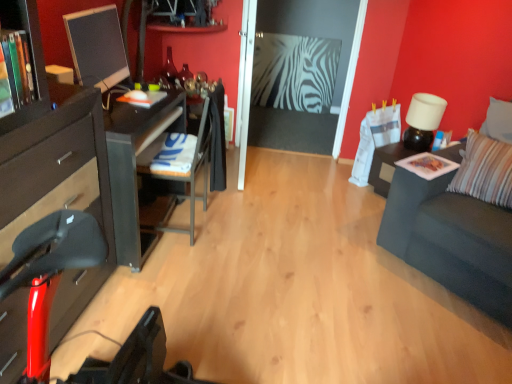
Image resolution: width=512 pixels, height=384 pixels. What do you see at coordinates (180, 163) in the screenshot?
I see `metallic gray chair at center-left` at bounding box center [180, 163].

What do you see at coordinates (451, 240) in the screenshot? I see `dark gray fabric couch at right` at bounding box center [451, 240].

The width and height of the screenshot is (512, 384). What do you see at coordinates (30, 61) in the screenshot?
I see `wooden bookshelf at left` at bounding box center [30, 61].

Image resolution: width=512 pixels, height=384 pixels. Identify the location of wooden bookshelf at left. (30, 61).

The image size is (512, 384). Identify the location of white matte lamp at upper right. (423, 121).

Locate an element on the screen. metallic silver shelf at upper center is located at coordinates (183, 16).

At what (x,y) coordinates should I click in order to perform the action: click on striped fabric pillow at right. Please return your answer as a coordinate pair (x, y). Looking at the image, I should click on (485, 170).

Considering the relative sizes of white matte lamp at upper right and striped fabric pillow at right in the image provided, is white matte lamp at upper right wider than striped fabric pillow at right?

Incorrect, the width of white matte lamp at upper right does not surpass that of striped fabric pillow at right.

Which object is positioned more to the right, white matte lamp at upper right or striped fabric pillow at right?

From the viewer's perspective, striped fabric pillow at right appears more on the right side.

Is white matte lamp at upper right beside striped fabric pillow at right?

white matte lamp at upper right and striped fabric pillow at right are not in contact.

Is striped fabric pillow at right with dark gray fabric couch at right?

No, striped fabric pillow at right is not next to dark gray fabric couch at right.

In the scene shown: Do you think striped fabric pillow at right is within dark gray fabric couch at right, or outside of it?

striped fabric pillow at right can be found inside dark gray fabric couch at right.

How different are the orientations of striped fabric pillow at right and dark gray fabric couch at right in degrees?

striped fabric pillow at right and dark gray fabric couch at right are facing 14.5 degrees away from each other.

Consider the image. Is matte black monitor at left in contact with metallic silver shelf at upper center?

No, matte black monitor at left is not in contact with metallic silver shelf at upper center.

In the image, is matte black monitor at left positioned in front of or behind metallic silver shelf at upper center?

Visually, matte black monitor at left is located in front of metallic silver shelf at upper center.

From a real-world perspective, is matte black monitor at left positioned over metallic silver shelf at upper center based on gravity?

No, from a real-world perspective, matte black monitor at left is not over metallic silver shelf at upper center

From the image's perspective, is matte black monitor at left over metallic silver shelf at upper center?

No, from the image's perspective, matte black monitor at left is not above metallic silver shelf at upper center.

Considering their positions, is striped fabric pillow at right located in front of or behind metallic gray chair at center-left?

Visually, striped fabric pillow at right is located in front of metallic gray chair at center-left.

Between striped fabric pillow at right and metallic gray chair at center-left, which one appears on the left side from the viewer's perspective?

From the viewer's perspective, metallic gray chair at center-left appears more on the left side.

Consider the image. Is striped fabric pillow at right next to metallic gray chair at center-left and touching it?

No, striped fabric pillow at right is not in contact with metallic gray chair at center-left.

Can you confirm if striped fabric pillow at right is bigger than metallic gray chair at center-left?

No.

Are white matte lamp at upper right and dark gray fabric couch at right located far from each other?

No, white matte lamp at upper right is in close proximity to dark gray fabric couch at right.

Consider the image. What's the angular difference between white matte lamp at upper right and dark gray fabric couch at right's facing directions?

2.84 degrees separate the facing orientations of white matte lamp at upper right and dark gray fabric couch at right.

In terms of size, does white matte lamp at upper right appear bigger or smaller than dark gray fabric couch at right?

white matte lamp at upper right is smaller than dark gray fabric couch at right.

I want to click on studio couch on the right of the white matte lamp at upper right, so click(451, 240).

Does black glossy nightstand at right have a lesser height compared to wooden bookshelf at left?

Incorrect, the height of black glossy nightstand at right does not fall short of that of wooden bookshelf at left.

Considering the relative positions of black glossy nightstand at right and wooden bookshelf at left in the image provided, is black glossy nightstand at right to the left or to the right of wooden bookshelf at left?

Based on their positions, black glossy nightstand at right is located to the right of wooden bookshelf at left.

Considering the sizes of objects black glossy nightstand at right and wooden bookshelf at left in the image provided, who is thinner, black glossy nightstand at right or wooden bookshelf at left?

Thinner between the two is wooden bookshelf at left.

Is black glossy nightstand at right positioned far away from wooden bookshelf at left?

black glossy nightstand at right is positioned a significant distance from wooden bookshelf at left.

Could you tell me if striped fabric pillow at right is turned towards metallic silver shelf at upper center?

No, striped fabric pillow at right is not oriented towards metallic silver shelf at upper center.

How many degrees apart are the facing directions of striped fabric pillow at right and metallic silver shelf at upper center?

The angular difference between striped fabric pillow at right and metallic silver shelf at upper center is 32.8 degrees.

Is striped fabric pillow at right next to metallic silver shelf at upper center and touching it?

No, striped fabric pillow at right is not with metallic silver shelf at upper center.

Which is closer, (471, 187) or (182, 21)?

The point (471, 187) is in front.

Where is `lamp above the striped fabric pillow at right (from the image's perspective)`? The height and width of the screenshot is (384, 512). lamp above the striped fabric pillow at right (from the image's perspective) is located at coordinates (423, 121).

Identify the location of studio couch in front of the striped fabric pillow at right. (451, 240).

Considering their positions, is matte black monitor at left positioned further to dark gray fabric couch at right than striped fabric pillow at right?

The object further to dark gray fabric couch at right is matte black monitor at left.

Looking at the image, which one is located further to matte black monitor at left, metallic gray chair at center-left or white matte lamp at upper right?

Among the two, white matte lamp at upper right is located further to matte black monitor at left.

From the image, which object appears to be farther from wooden bookshelf at left, white matte lamp at upper right or metallic gray chair at center-left?

Based on the image, white matte lamp at upper right appears to be further to wooden bookshelf at left.

Considering their positions, is wooden bookshelf at left positioned further to matte black monitor at left than striped fabric pillow at right?

Among the two, striped fabric pillow at right is located further to matte black monitor at left.

Looking at the image, which one is located further to black glossy nightstand at right, metallic silver shelf at upper center or striped fabric pillow at right?

metallic silver shelf at upper center is positioned further to the anchor black glossy nightstand at right.

Based on their spatial positions, is striped fabric pillow at right or black glossy nightstand at right closer to wooden bookshelf at left?

striped fabric pillow at right lies closer to wooden bookshelf at left than the other object.

From the image, which object appears to be nearer to dark gray fabric couch at right, metallic gray chair at center-left or wooden bookshelf at left?

metallic gray chair at center-left.

Looking at the image, which one is located closer to matte black monitor at left, wooden bookshelf at left or metallic gray chair at center-left?

metallic gray chair at center-left is positioned closer to the anchor matte black monitor at left.

Identify the location of nightstand between wooden bookshelf at left and white matte lamp at upper right. pos(386,166).

Where is `nightstand located between metallic gray chair at center-left and white matte lamp at upper right in the left-right direction`? nightstand located between metallic gray chair at center-left and white matte lamp at upper right in the left-right direction is located at coordinates (386, 166).

The width and height of the screenshot is (512, 384). What are the coordinates of `shelf situated between matte black monitor at left and white matte lamp at upper right from left to right` in the screenshot? It's located at (183, 16).

I want to click on computer monitor between wooden bookshelf at left and metallic gray chair at center-left in the front-back direction, so click(x=98, y=49).